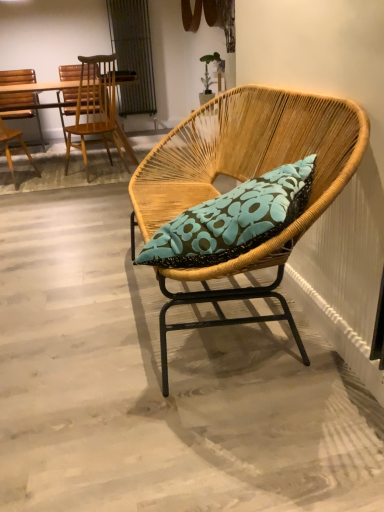
The height and width of the screenshot is (512, 384). What do you see at coordinates (242, 181) in the screenshot?
I see `woven wood chair at center, the 1th chair viewed from the right` at bounding box center [242, 181].

You are a GUI agent. You are given a task and a screenshot of the screen. Output one action in this format:
    pyautogui.click(x=<x>, y=<y>)
    Task: Click on the brown wooden desk at left
    The image size is (384, 512).
    Given the screenshot: What is the action you would take?
    pyautogui.click(x=38, y=87)

Locate an element on the screen. The width and height of the screenshot is (384, 512). wooden chair at left, the 3th chair viewed from the front is located at coordinates (17, 77).

Could woven wood chair at center, the 3th chair in the back-to-front sequence, be considered to be inside brown wooden desk at left?

No, woven wood chair at center, the 3th chair in the back-to-front sequence, is not a part of brown wooden desk at left.

Is brown wooden desk at left far away from woven wood chair at center, marked as the 1th chair in a front-to-back arrangement?

Absolutely, brown wooden desk at left is distant from woven wood chair at center, marked as the 1th chair in a front-to-back arrangement.

Between brown wooden desk at left and woven wood chair at center, marked as the 1th chair in a front-to-back arrangement, which one has smaller width?

With smaller width is woven wood chair at center, marked as the 1th chair in a front-to-back arrangement.

Is point (118, 126) positioned before point (228, 174)?

No.

From the image's perspective, is wooden chair at left, acting as the 1th chair starting from the back, beneath woven wood chair at center, the 3th chair in the back-to-front sequence?

No, from the image's perspective, wooden chair at left, acting as the 1th chair starting from the back, is not below woven wood chair at center, the 3th chair in the back-to-front sequence.

Measure the distance between wooden chair at left, acting as the 1th chair starting from the back, and woven wood chair at center, marked as the 1th chair in a front-to-back arrangement.

wooden chair at left, acting as the 1th chair starting from the back, and woven wood chair at center, marked as the 1th chair in a front-to-back arrangement, are 2.58 meters apart from each other.

Is wooden chair at left, arranged as the first chair when viewed from the left, further to camera compared to woven wood chair at center, the 1th chair viewed from the right?

Yes, it is behind woven wood chair at center, the 1th chair viewed from the right.

Does wooden chair at left, acting as the 1th chair starting from the back, have a larger size compared to woven wood chair at center, marked as the 1th chair in a front-to-back arrangement?

No.

Would you say wooden chair at upper left, which is counted as the second chair, starting from the back, is inside or outside wooden chair at left, arranged as the first chair when viewed from the left?

wooden chair at upper left, which is counted as the second chair, starting from the back, cannot be found inside wooden chair at left, arranged as the first chair when viewed from the left.

Find the location of a particular element. chair on the left of the wooden chair at upper left, which is counted as the second chair, starting from the right is located at coordinates (17, 77).

From a real-world perspective, between wooden chair at upper left, which is counted as the 2th chair, starting from the left, and wooden chair at left, the 3th chair viewed from the front, who is vertically lower?

wooden chair at left, the 3th chair viewed from the front.

From the brown wooden desk at left, count 1st chairs forward and point to it. Please provide its 2D coordinates.

[(96, 109)]

Would you say brown wooden desk at left contains wooden chair at upper left, positioned as the second chair in front-to-back order?

No, wooden chair at upper left, positioned as the second chair in front-to-back order, is not surrounded by brown wooden desk at left.

How many degrees apart are the facing directions of brown wooden desk at left and wooden chair at upper left, positioned as the second chair in front-to-back order?

The facing directions of brown wooden desk at left and wooden chair at upper left, positioned as the second chair in front-to-back order, are 156 degrees apart.

Looking at the image, does brown wooden desk at left seem bigger or smaller compared to wooden chair at upper left, which is counted as the 2th chair, starting from the left?

Considering their sizes, brown wooden desk at left takes up more space than wooden chair at upper left, which is counted as the 2th chair, starting from the left.

Who is shorter, wooden chair at upper left, positioned as the second chair in front-to-back order, or brown wooden desk at left?

brown wooden desk at left is shorter.

Is brown wooden desk at left at the back of wooden chair at upper left, positioned as the second chair in front-to-back order?

No, brown wooden desk at left is not at the back of wooden chair at upper left, positioned as the second chair in front-to-back order.

Looking at this image, in terms of width, does wooden chair at upper left, positioned as the second chair in front-to-back order, look wider or thinner when compared to brown wooden desk at left?

In the image, wooden chair at upper left, positioned as the second chair in front-to-back order, appears to be more narrow than brown wooden desk at left.

Is wooden chair at upper left, which is counted as the 2th chair, starting from the left, in front of brown wooden desk at left?

Yes, wooden chair at upper left, which is counted as the 2th chair, starting from the left, is in front of brown wooden desk at left.

From the image's perspective, which is below, woven wood chair at center, the 3th chair in the back-to-front sequence, or wooden chair at upper left, which is counted as the 2th chair, starting from the left?

woven wood chair at center, the 3th chair in the back-to-front sequence.

From the picture: Is woven wood chair at center, the 3th chair in the back-to-front sequence, spatially inside wooden chair at upper left, which is counted as the 2th chair, starting from the left, or outside of it?

woven wood chair at center, the 3th chair in the back-to-front sequence, lies outside wooden chair at upper left, which is counted as the 2th chair, starting from the left.

Is wooden chair at upper left, which is counted as the second chair, starting from the right, at the back of woven wood chair at center, marked as the 1th chair in a front-to-back arrangement?

No, woven wood chair at center, marked as the 1th chair in a front-to-back arrangement, is not facing the opposite direction of wooden chair at upper left, which is counted as the second chair, starting from the right.

Is brown wooden desk at left beside wooden chair at left, which appears as the third chair when viewed from the right?

No, brown wooden desk at left is not next to wooden chair at left, which appears as the third chair when viewed from the right.

Is brown wooden desk at left in front of or behind wooden chair at left, which appears as the third chair when viewed from the right, in the image?

In the image, brown wooden desk at left appears in front of wooden chair at left, which appears as the third chair when viewed from the right.

Who is smaller, brown wooden desk at left or wooden chair at left, acting as the 1th chair starting from the back?

wooden chair at left, acting as the 1th chair starting from the back, is smaller.

This screenshot has width=384, height=512. Identify the location of desk below the woven wood chair at center, marked as the 1th chair in a front-to-back arrangement (from a real-world perspective). (38, 87).

Locate an element on the screen. This screenshot has width=384, height=512. the 2nd chair to the left of the woven wood chair at center, which ranks as the third chair in left-to-right order, starting your count from the anchor is located at coordinates (17, 77).

Looking at this image, from the image, which object appears to be farther from brown wooden desk at left, wooden chair at upper left, which is counted as the 2th chair, starting from the left, or woven wood chair at center, the 3th chair in the back-to-front sequence?

Among the two, woven wood chair at center, the 3th chair in the back-to-front sequence, is located further to brown wooden desk at left.

From the picture: Considering their positions, is brown wooden desk at left positioned further to woven wood chair at center, which ranks as the third chair in left-to-right order, than wooden chair at left, the 3th chair viewed from the front?

wooden chair at left, the 3th chair viewed from the front.

From the picture: Looking at the image, which one is located closer to wooden chair at upper left, positioned as the second chair in front-to-back order, wooden chair at left, which appears as the third chair when viewed from the right, or woven wood chair at center, the 3th chair in the back-to-front sequence?

Among the two, wooden chair at left, which appears as the third chair when viewed from the right, is located nearer to wooden chair at upper left, positioned as the second chair in front-to-back order.

From the image, which object appears to be farther from wooden chair at upper left, which is counted as the second chair, starting from the right, woven wood chair at center, the 3th chair in the back-to-front sequence, or brown wooden desk at left?

Among the two, woven wood chair at center, the 3th chair in the back-to-front sequence, is located further to wooden chair at upper left, which is counted as the second chair, starting from the right.

Which object lies nearer to the anchor point wooden chair at upper left, positioned as the second chair in front-to-back order, brown wooden desk at left or woven wood chair at center, the 1th chair viewed from the right?

The object closer to wooden chair at upper left, positioned as the second chair in front-to-back order, is brown wooden desk at left.

When comparing their distances from woven wood chair at center, the 1th chair viewed from the right, does wooden chair at left, acting as the 1th chair starting from the back, or wooden chair at upper left, which is counted as the second chair, starting from the right, seem further?

wooden chair at left, acting as the 1th chair starting from the back.

Considering their positions, is wooden chair at left, acting as the 1th chair starting from the back, positioned closer to brown wooden desk at left than wooden chair at upper left, which is counted as the second chair, starting from the back?

wooden chair at left, acting as the 1th chair starting from the back.

Looking at the image, which one is located closer to wooden chair at left, the 3th chair viewed from the front, wooden chair at upper left, which is counted as the second chair, starting from the right, or woven wood chair at center, the 1th chair viewed from the right?

wooden chair at upper left, which is counted as the second chair, starting from the right.

Image resolution: width=384 pixels, height=512 pixels. I want to click on desk positioned between wooden chair at upper left, positioned as the second chair in front-to-back order, and wooden chair at left, acting as the 1th chair starting from the back, from near to far, so click(38, 87).

The height and width of the screenshot is (512, 384). Find the location of `chair located between woven wood chair at center, the 3th chair in the back-to-front sequence, and brown wooden desk at left in the depth direction`. chair located between woven wood chair at center, the 3th chair in the back-to-front sequence, and brown wooden desk at left in the depth direction is located at coordinates pos(96,109).

Find the location of a particular element. The width and height of the screenshot is (384, 512). chair between woven wood chair at center, the 1th chair viewed from the right, and wooden chair at left, the 3th chair viewed from the front, in the front-back direction is located at coordinates (96, 109).

The width and height of the screenshot is (384, 512). I want to click on desk between woven wood chair at center, which ranks as the third chair in left-to-right order, and wooden chair at left, acting as the 1th chair starting from the back, in the front-back direction, so click(x=38, y=87).